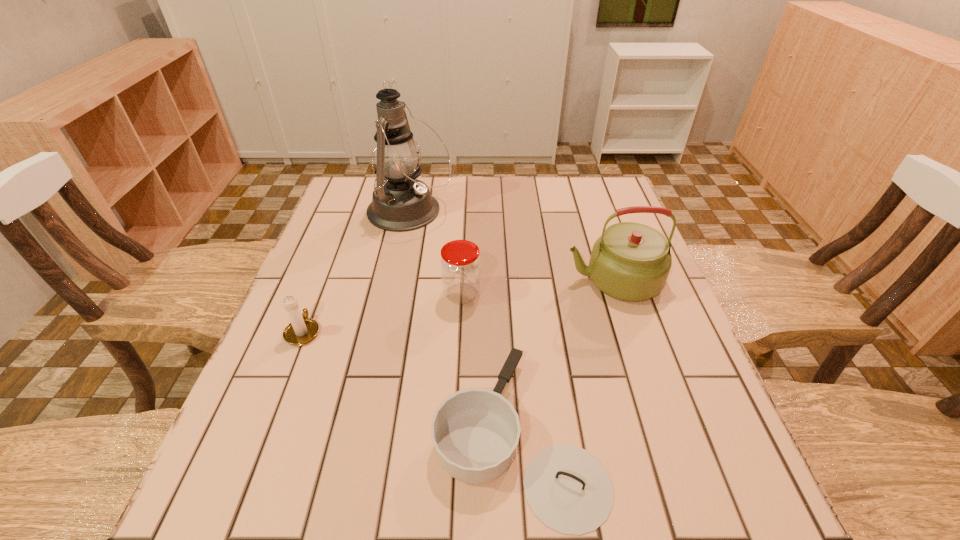
I want to click on free space that satisfies the following two spatial constraints: 1. on the handle side of the jar; 2. on the right side of the leftmost object, so click(318, 294).

Locate an element on the screen. Image resolution: width=960 pixels, height=540 pixels. free location that satisfies the following two spatial constraints: 1. on the handle side of the tallest object; 2. on the left side of the second shortest object is located at coordinates (349, 212).

At what (x,y) coordinates should I click in order to perform the action: click on vacant region that satisfies the following two spatial constraints: 1. on the handle side of the farthest object; 2. on the right side of the fourth farthest object. Please return your answer as a coordinate pair (x, y). The width and height of the screenshot is (960, 540). Looking at the image, I should click on (349, 212).

This screenshot has height=540, width=960. Identify the location of vacant space that satisfies the following two spatial constraints: 1. on the handle side of the jar; 2. on the right side of the candle holder. (318, 294).